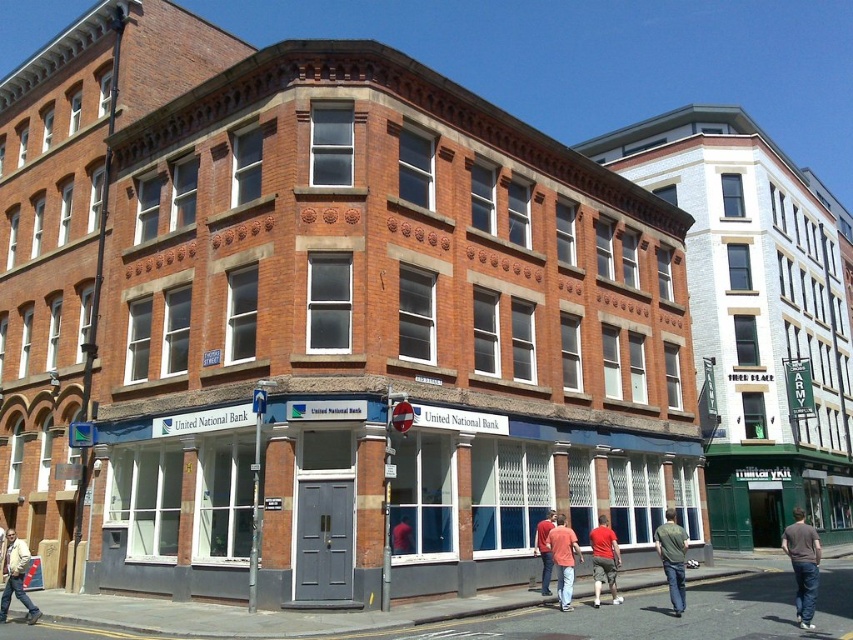
Question: Which point is closer to the camera?

Choices:
 (A) (606, 532)
 (B) (550, 544)
 (C) (399, 529)

Answer: (B)

Question: From the image, what is the correct spatial relationship of brick facade bank at center in relation to red shirt at center?

Choices:
 (A) above
 (B) below

Answer: (A)

Question: Is brick facade bank at center bigger than brown cotton shirt at lower right?

Choices:
 (A) no
 (B) yes

Answer: (B)

Question: Which of the following is the farthest from the observer?

Choices:
 (A) (20, 560)
 (B) (788, 547)
 (C) (163, 240)

Answer: (C)

Question: Does brown cotton shirt at lower right have a smaller size compared to red cotton t-shirt at center?

Choices:
 (A) yes
 (B) no

Answer: (B)

Question: Which object is positioned closest to the matte pink shirt at center?

Choices:
 (A) brown cotton shirt at lower right
 (B) matte red shirt at center

Answer: (B)